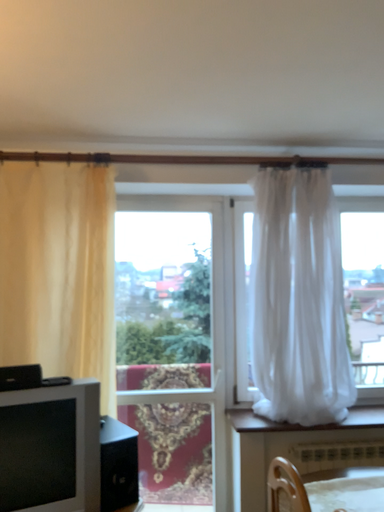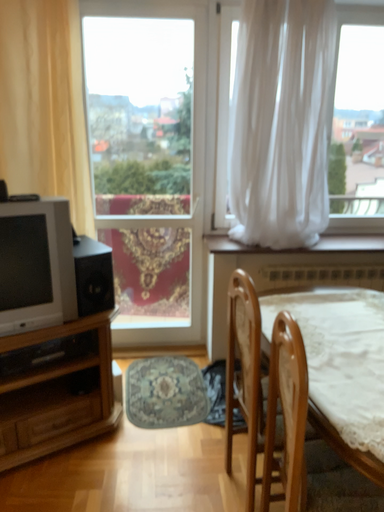
Question: Which way did the camera rotate in the video?

Choices:
 (A) rotated downward
 (B) rotated upward

Answer: (A)